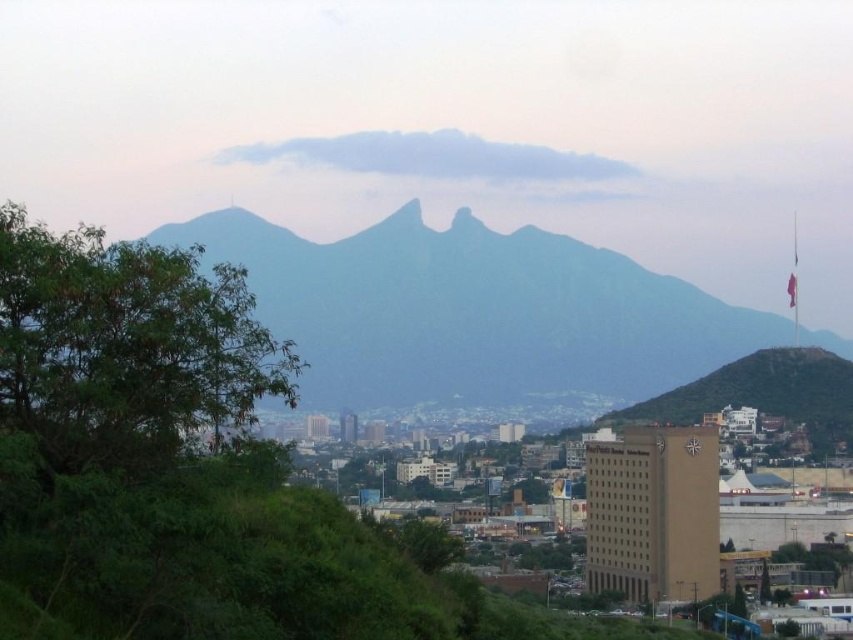
Question: Which point appears farthest from the camera in this image?

Choices:
 (A) (109, 339)
 (B) (306, 248)

Answer: (A)

Question: Among these points, which one is nearest to the camera?

Choices:
 (A) (642, 292)
 (B) (206, 317)

Answer: (B)

Question: Can you confirm if gray rock formation at center is positioned to the right of green leafy tree at left?

Choices:
 (A) yes
 (B) no

Answer: (A)

Question: Observing the image, what is the correct spatial positioning of gray rock formation at center in reference to green leafy tree at left?

Choices:
 (A) below
 (B) above

Answer: (B)

Question: Is gray rock formation at center thinner than green leafy tree at left?

Choices:
 (A) yes
 (B) no

Answer: (B)

Question: Which point is closer to the camera taking this photo?

Choices:
 (A) (18, 336)
 (B) (296, 301)

Answer: (B)